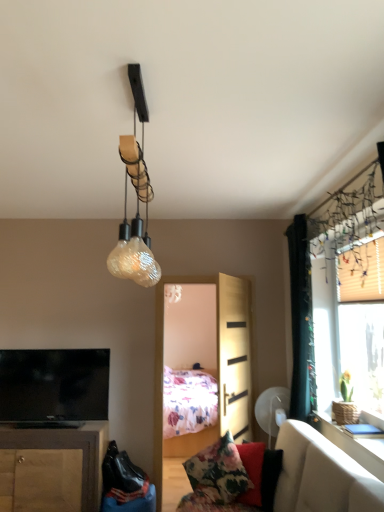
Question: From a real-world perspective, is light wood screen door at center located higher than wooden cabinet at lower left?

Choices:
 (A) no
 (B) yes

Answer: (B)

Question: Is light wood screen door at center outside wooden cabinet at lower left?

Choices:
 (A) no
 (B) yes

Answer: (B)

Question: Is light wood screen door at center wider than wooden cabinet at lower left?

Choices:
 (A) no
 (B) yes

Answer: (A)

Question: Could you tell me if light wood screen door at center is turned towards wooden cabinet at lower left?

Choices:
 (A) no
 (B) yes

Answer: (B)

Question: Does light wood screen door at center have a lesser height compared to wooden cabinet at lower left?

Choices:
 (A) no
 (B) yes

Answer: (A)

Question: Can you confirm if light wood screen door at center is bigger than wooden cabinet at lower left?

Choices:
 (A) no
 (B) yes

Answer: (A)

Question: Is wooden cabinet at lower left to the left of floral fabric pillow at lower center from the viewer's perspective?

Choices:
 (A) yes
 (B) no

Answer: (A)

Question: Considering the relative positions of wooden cabinet at lower left and floral fabric pillow at lower center in the image provided, is wooden cabinet at lower left to the right of floral fabric pillow at lower center from the viewer's perspective?

Choices:
 (A) yes
 (B) no

Answer: (B)

Question: Is wooden cabinet at lower left smaller than floral fabric pillow at lower center?

Choices:
 (A) no
 (B) yes

Answer: (A)

Question: Does wooden cabinet at lower left turn towards floral fabric pillow at lower center?

Choices:
 (A) no
 (B) yes

Answer: (A)

Question: Is wooden cabinet at lower left bigger than floral fabric pillow at lower center?

Choices:
 (A) no
 (B) yes

Answer: (B)

Question: From a real-world perspective, is wooden cabinet at lower left on top of floral fabric pillow at lower center?

Choices:
 (A) yes
 (B) no

Answer: (B)

Question: From a real-world perspective, is floral fabric pillow at lower center below black fabric curtain at right?

Choices:
 (A) no
 (B) yes

Answer: (B)